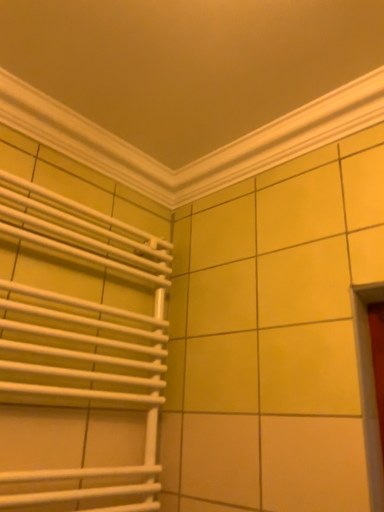
Identify the location of white matte radiator at left. The height and width of the screenshot is (512, 384). (81, 338).

What is the approximate height of white matte radiator at left?

white matte radiator at left is 75.90 centimeters in height.

What do you see at coordinates (81, 338) in the screenshot? This screenshot has width=384, height=512. I see `white matte radiator at left` at bounding box center [81, 338].

Where is `white matte radiator at left`? The image size is (384, 512). white matte radiator at left is located at coordinates (81, 338).